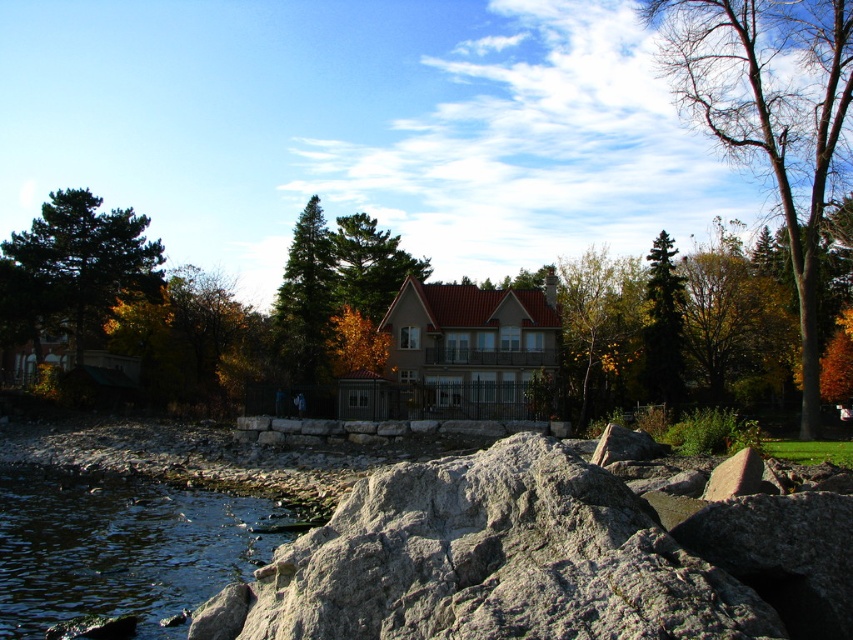
At what (x,y) coordinates should I click in order to perform the action: click on brown textured tree at upper right. Please return your answer as a coordinate pair (x, y). Image resolution: width=853 pixels, height=640 pixels. Looking at the image, I should click on point(769,115).

Locate an element on the screen. Image resolution: width=853 pixels, height=640 pixels. brown textured tree at upper right is located at coordinates (769, 115).

This screenshot has height=640, width=853. I want to click on brown textured tree at upper right, so click(x=769, y=115).

Is point (136, 237) farther from camera compared to point (367, 276)?

No, it is in front of (367, 276).

Can you confirm if green matte tree at left is wider than green textured pine tree at center?

Correct, the width of green matte tree at left exceeds that of green textured pine tree at center.

Is point (57, 208) farther from camera compared to point (389, 257)?

No, it is not.

Find the location of a particular element. The height and width of the screenshot is (640, 853). green matte tree at left is located at coordinates (86, 257).

Does point (512, 588) come behind point (296, 378)?

No, it is not.

Does gray rough rock at lower left have a lesser width compared to green matte tree at center?

Indeed, gray rough rock at lower left has a lesser width compared to green matte tree at center.

Does point (466, 464) come in front of point (320, 268)?

Yes, point (466, 464) is in front of point (320, 268).

Where is `gray rough rock at lower left`? The image size is (853, 640). gray rough rock at lower left is located at coordinates (544, 561).